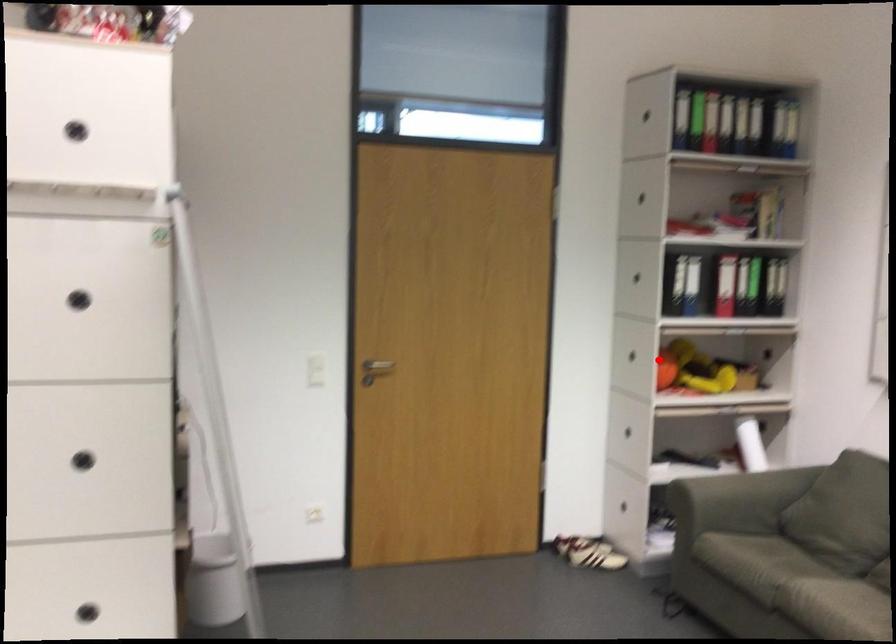
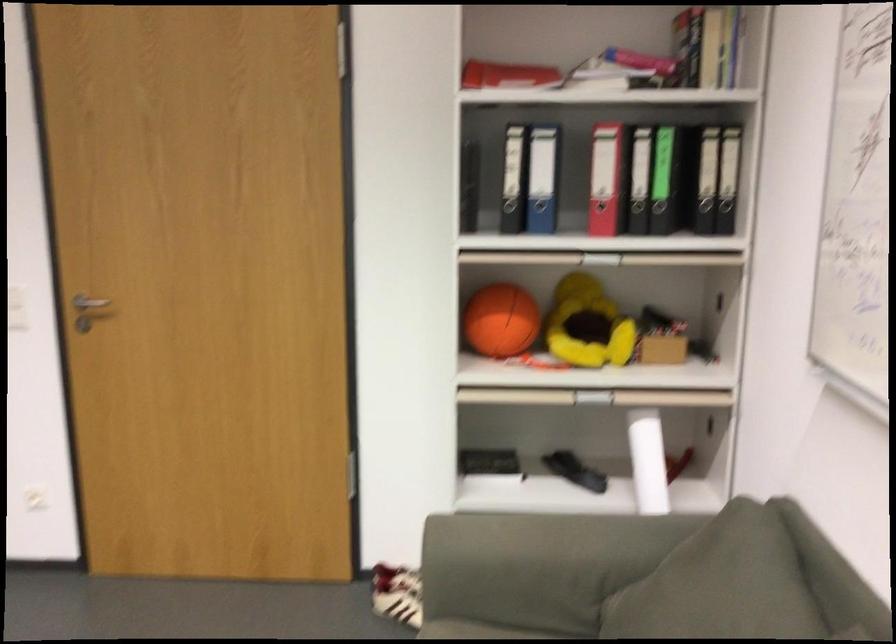
The point at the highlighted location is marked in the first image. Where is the corresponding point in the second image?

(501, 321)